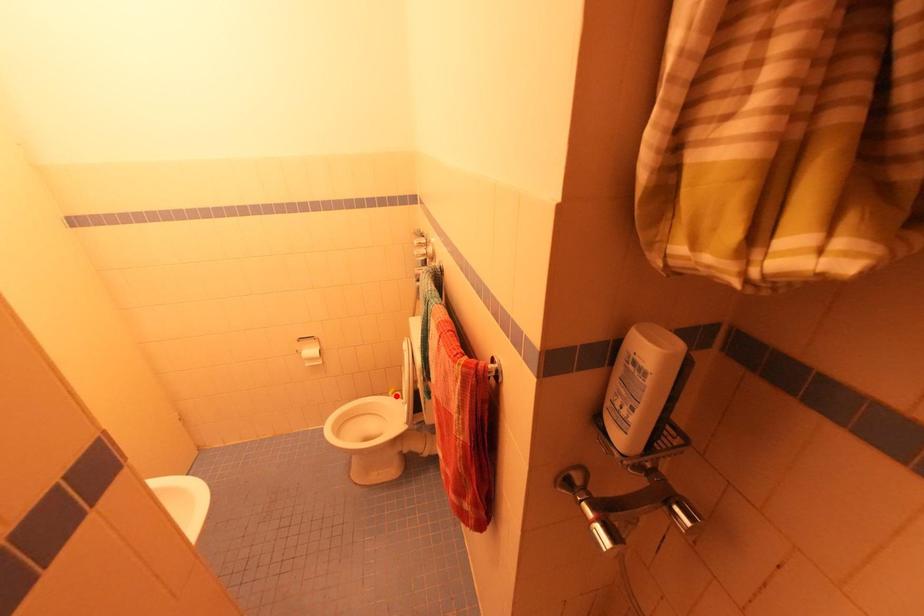
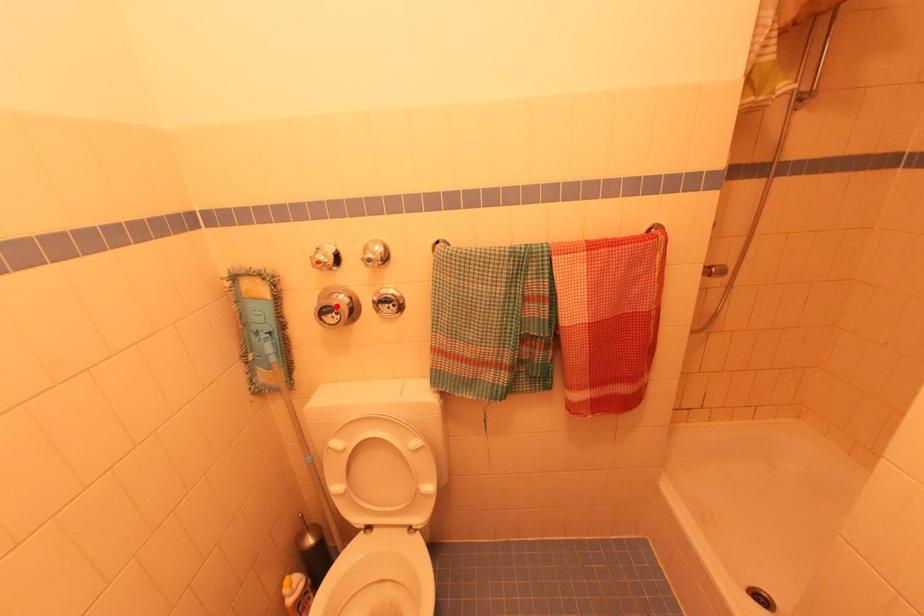
I am providing you with two images of the same scene from different viewpoints. A red point is marked on the first image and another point is marked on the second image. Are the points marked in image1 and image2 representing the same 3D position?

No